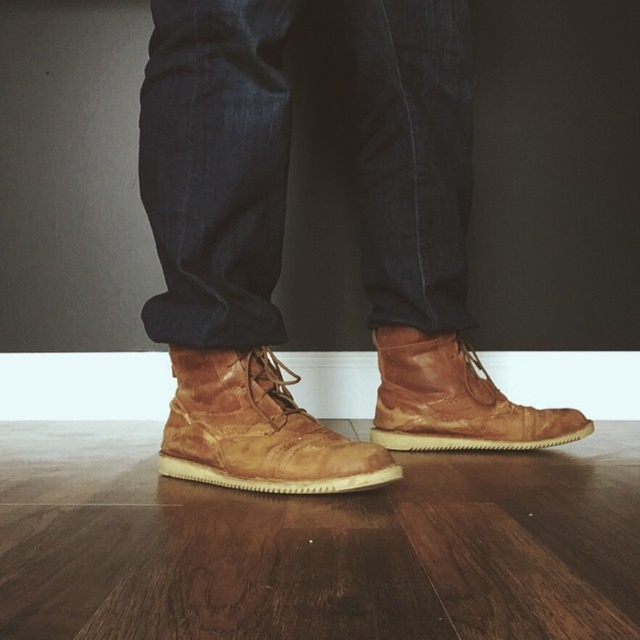
Question: Among these objects, which one is nearest to the camera?

Choices:
 (A) leather boot at center
 (B) leather boot at lower right

Answer: (A)

Question: From the image, what is the correct spatial relationship of dark blue denim jeans at center in relation to leather boot at center?

Choices:
 (A) above
 (B) below

Answer: (A)

Question: Which point is closer to the camera?

Choices:
 (A) (448, 348)
 (B) (195, 404)
 (C) (177, 12)

Answer: (C)

Question: Can you confirm if dark blue denim jeans at center is positioned to the right of leather boot at center?

Choices:
 (A) no
 (B) yes

Answer: (B)

Question: Which object appears farthest from the camera in this image?

Choices:
 (A) leather boot at lower right
 (B) leather boot at center
 (C) dark blue denim jeans at center

Answer: (A)

Question: Is dark blue denim jeans at center thinner than leather boot at lower right?

Choices:
 (A) no
 (B) yes

Answer: (A)